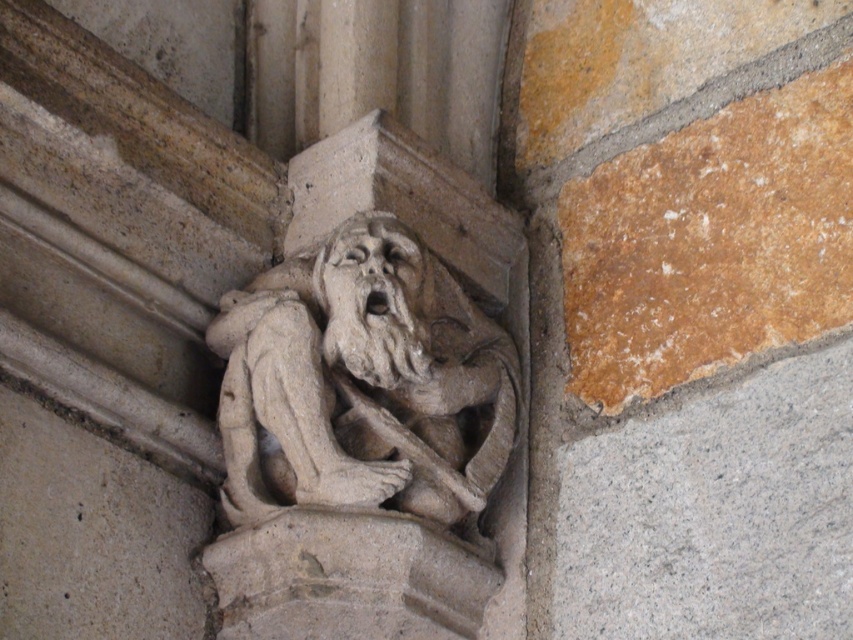
Question: Does stone carved gargoyle at center appear on the right side of gray stone face at center?

Choices:
 (A) yes
 (B) no

Answer: (A)

Question: Among these objects, which one is nearest to the camera?

Choices:
 (A) gray stone face at center
 (B) stone carved gargoyle at center

Answer: (B)

Question: Can you confirm if stone carved gargoyle at center is positioned to the right of gray stone face at center?

Choices:
 (A) no
 (B) yes

Answer: (B)

Question: Among these points, which one is farthest from the camera?

Choices:
 (A) (334, 586)
 (B) (355, 376)

Answer: (B)

Question: Observing the image, what is the correct spatial positioning of stone carved gargoyle at center in reference to gray stone face at center?

Choices:
 (A) above
 (B) below

Answer: (B)